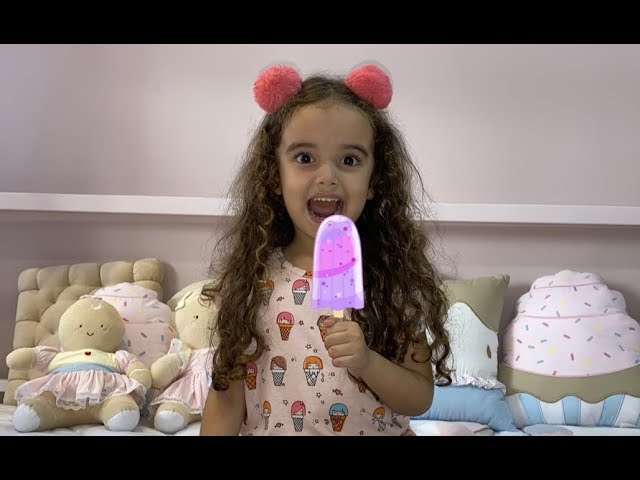
Identify the location of wall. The height and width of the screenshot is (480, 640). (166, 242), (180, 141).